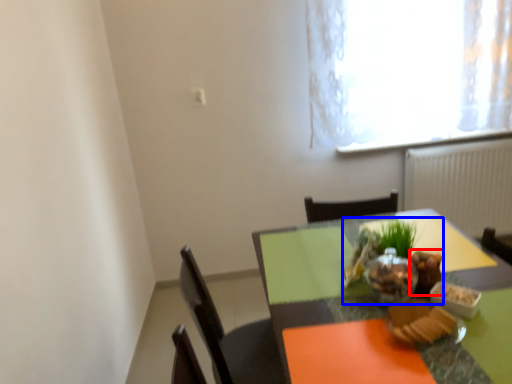
Question: Which object appears closest to the camera in this image, food (highlighted by a red box) or food (highlighted by a blue box)?

Choices:
 (A) food
 (B) food

Answer: (B)